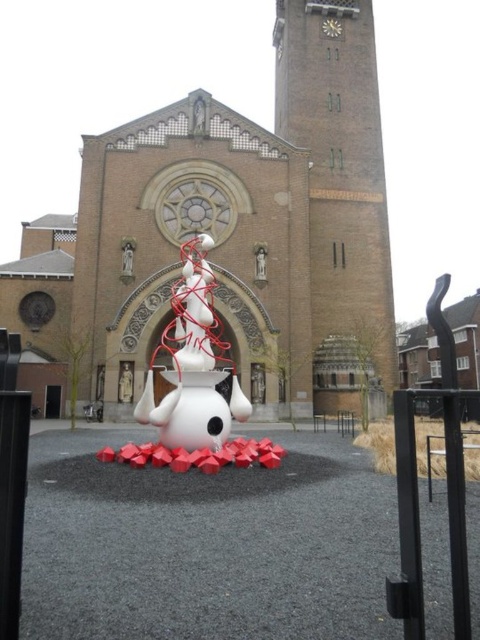
Which is below, brick clock tower at upper center or white glossy snowman at center?

Positioned lower is white glossy snowman at center.

Is brick clock tower at upper center positioned before white glossy snowman at center?

No, brick clock tower at upper center is further to the viewer.

Is point (317, 259) behind point (190, 296)?

Yes, point (317, 259) is farther from viewer.

Where is `brick clock tower at upper center`? The height and width of the screenshot is (640, 480). brick clock tower at upper center is located at coordinates (337, 196).

Which is behind, point (106, 408) or point (360, 332)?

The point (360, 332) is behind.

This screenshot has width=480, height=640. What do you see at coordinates (228, 234) in the screenshot?
I see `brown brick church at center` at bounding box center [228, 234].

Locate an element on the screen. This screenshot has height=640, width=480. brown brick church at center is located at coordinates pos(228,234).

Who is positioned more to the left, white glossy snowman at center or metallic clock at upper center?

Positioned to the left is white glossy snowman at center.

Is white glossy snowman at center above metallic clock at upper center?

Actually, white glossy snowman at center is below metallic clock at upper center.

Measure the distance between point [225,352] and camera.

Point [225,352] is 69.39 meters from camera.

Find the location of a particular element. white glossy snowman at center is located at coordinates (192, 364).